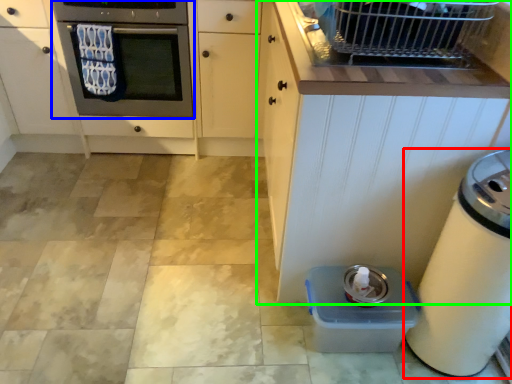
Question: Which is nearer to the home appliance (highlighted by a red box)? oven (highlighted by a blue box) or cabinetry (highlighted by a green box).

Choices:
 (A) oven
 (B) cabinetry

Answer: (B)